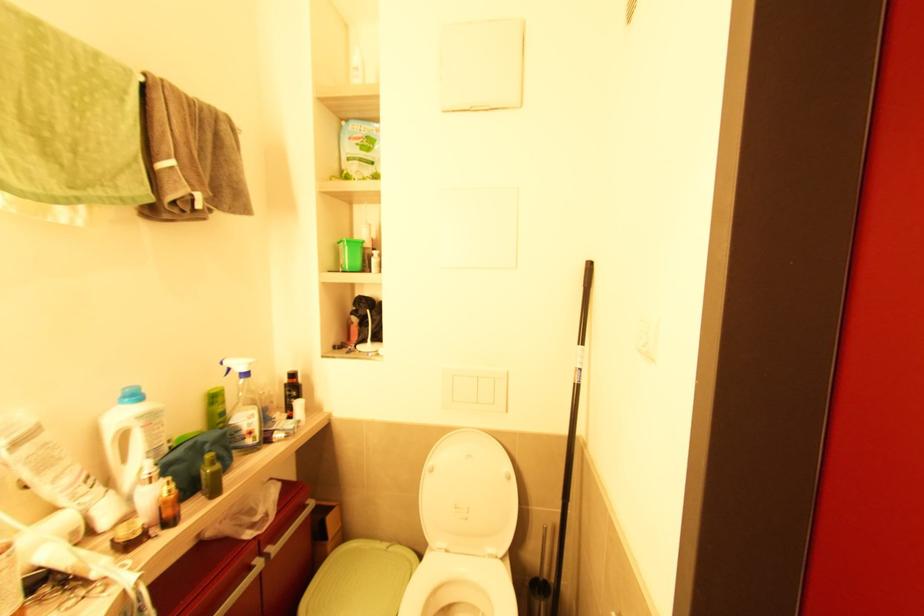
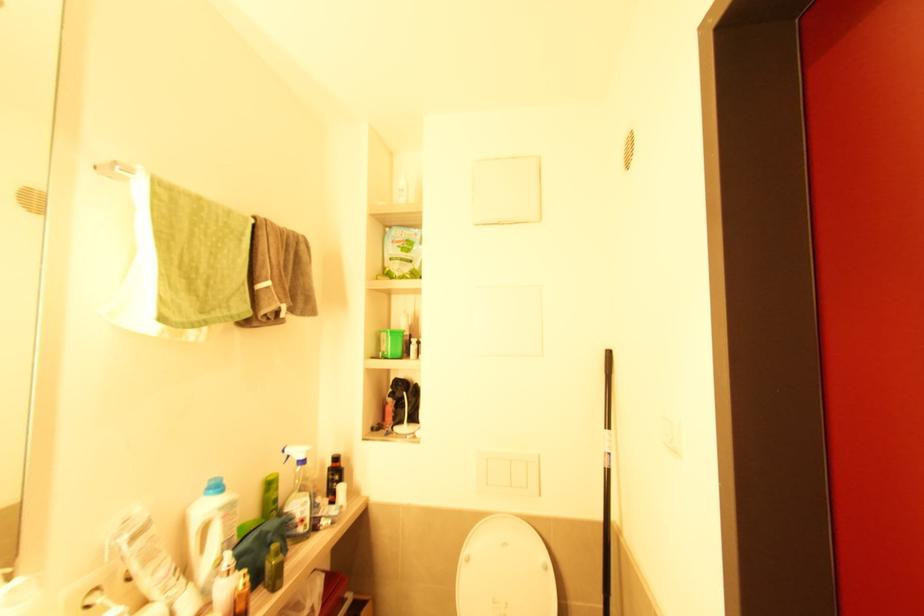
Locate, in the second image, the point that corresponds to the point at 144,428 in the first image.

(224, 519)